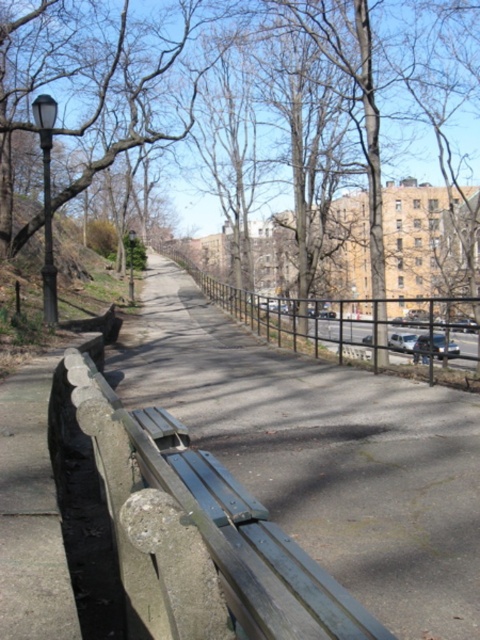
Question: Which point is closer to the camera?

Choices:
 (A) concrete bench at center
 (B) brown leafless tree at upper center
 (C) black metal fence at center

Answer: (A)

Question: Which of the following is the farthest from the observer?

Choices:
 (A) brown leafless tree at upper center
 (B) concrete bench at center

Answer: (A)

Question: Does concrete bench at center have a lesser width compared to brown leafless tree at upper center?

Choices:
 (A) yes
 (B) no

Answer: (A)

Question: Which point is farther to the camera?

Choices:
 (A) (323, 330)
 (B) (132, 77)
 (C) (283, 618)

Answer: (A)

Question: Observing the image, what is the correct spatial positioning of concrete bench at center in reference to black metal fence at center?

Choices:
 (A) above
 (B) below

Answer: (B)

Question: Does brown leafless tree at upper center appear on the right side of black metal fence at center?

Choices:
 (A) no
 (B) yes

Answer: (A)